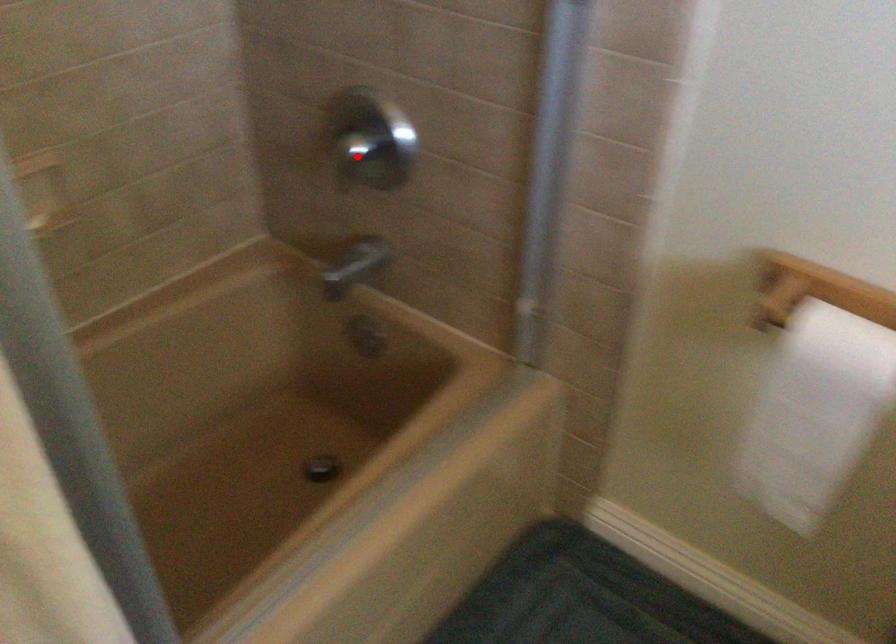
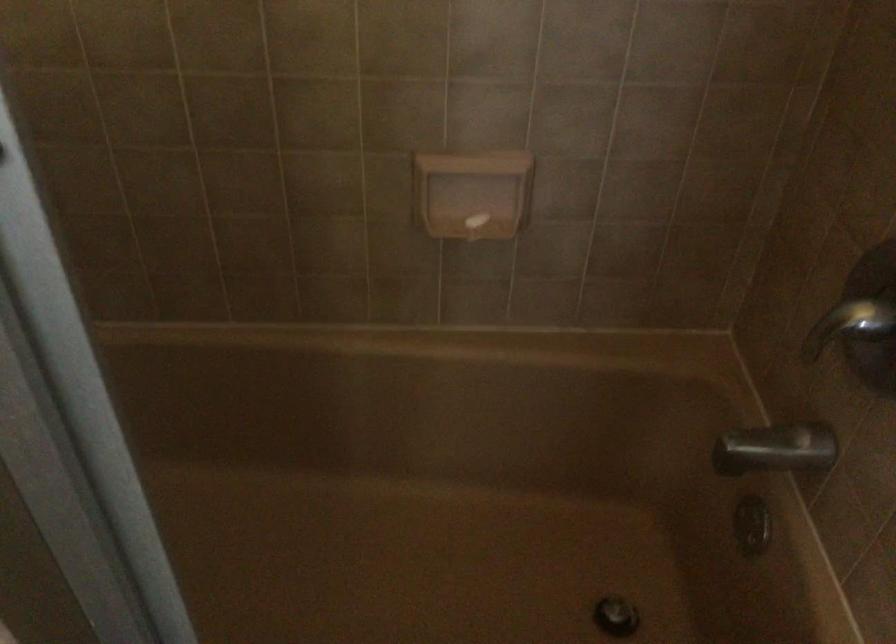
Question: I am providing you with two images of the same scene from different viewpoints. Image1 has a red point marked. In image2, the corresponding 3D location appears at what relative position? Reply with the corresponding letter.

Choices:
 (A) Closer
 (B) Farther

Answer: (A)